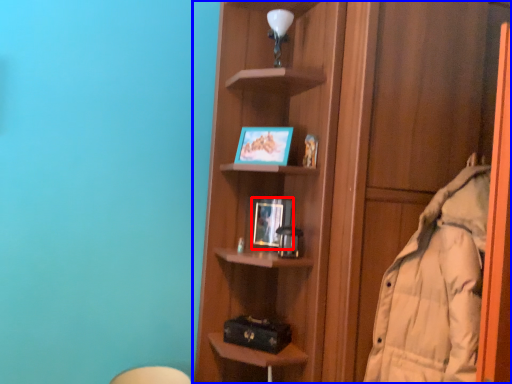
Question: Which object appears closest to the camera in this image, picture frame (highlighted by a red box) or shelf (highlighted by a blue box)?

Choices:
 (A) picture frame
 (B) shelf

Answer: (B)